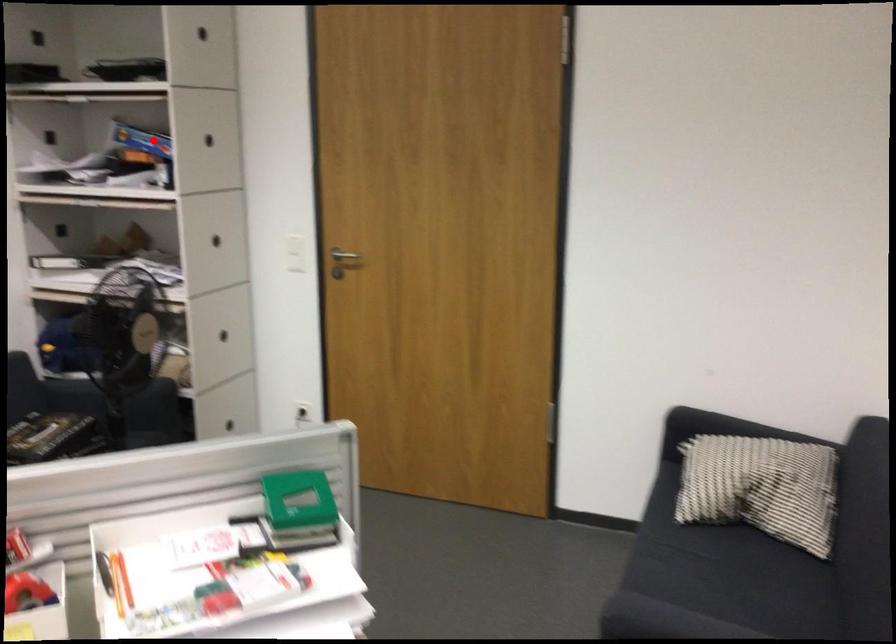
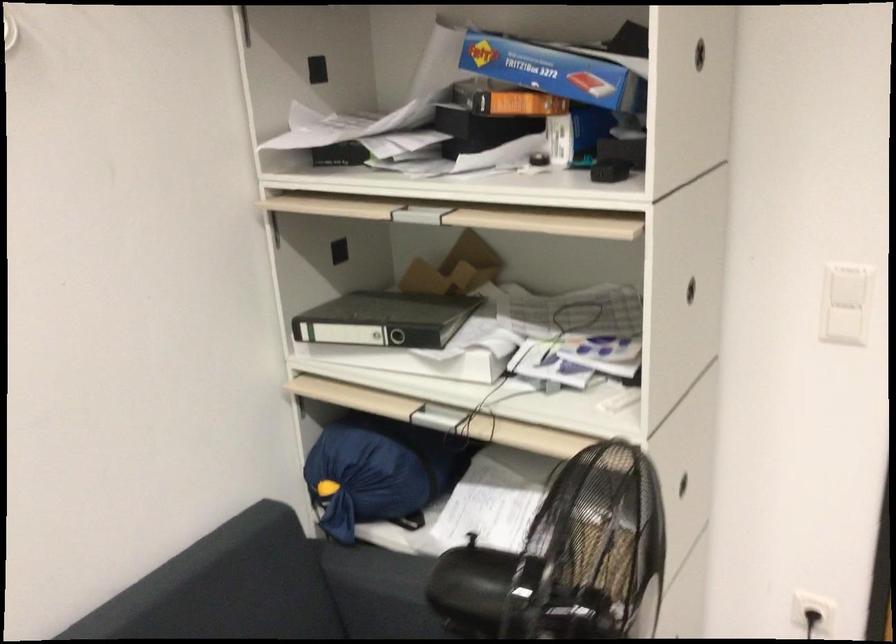
Find the pixel in the second image that matches the highlighted location in the first image.

(553, 71)